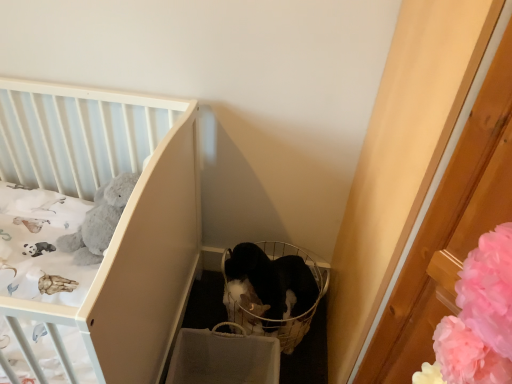
Question: Is black fabric basket at center surrounding white matte crib at upper left?

Choices:
 (A) no
 (B) yes

Answer: (A)

Question: Is black fabric basket at center oriented towards white matte crib at upper left?

Choices:
 (A) no
 (B) yes

Answer: (A)

Question: Considering the relative sizes of black fabric basket at center and white matte crib at upper left in the image provided, is black fabric basket at center bigger than white matte crib at upper left?

Choices:
 (A) no
 (B) yes

Answer: (A)

Question: From a real-world perspective, is black fabric basket at center physically above white matte crib at upper left?

Choices:
 (A) yes
 (B) no

Answer: (B)

Question: Considering the relative positions of black fabric basket at center and white matte crib at upper left in the image provided, is black fabric basket at center to the right of white matte crib at upper left from the viewer's perspective?

Choices:
 (A) yes
 (B) no

Answer: (A)

Question: Is black fur cat at center in front of or behind white matte crib at upper left in the image?

Choices:
 (A) behind
 (B) front

Answer: (A)

Question: Considering the positions of point (309, 281) and point (163, 142), is point (309, 281) closer or farther from the camera than point (163, 142)?

Choices:
 (A) closer
 (B) farther

Answer: (B)

Question: Considering the positions of black fur cat at center and white matte crib at upper left in the image, is black fur cat at center taller or shorter than white matte crib at upper left?

Choices:
 (A) tall
 (B) short

Answer: (B)

Question: Which is correct: black fur cat at center is inside white matte crib at upper left, or outside of it?

Choices:
 (A) outside
 (B) inside

Answer: (A)

Question: In terms of size, does white matte crib at upper left appear bigger or smaller than black fur cat at center?

Choices:
 (A) small
 (B) big

Answer: (B)

Question: From a real-world perspective, is white matte crib at upper left physically located above or below black fur cat at center?

Choices:
 (A) above
 (B) below

Answer: (A)

Question: From the image's perspective, is white matte crib at upper left above or below black fur cat at center?

Choices:
 (A) above
 (B) below

Answer: (A)

Question: Is white matte crib at upper left situated inside black fur cat at center or outside?

Choices:
 (A) inside
 (B) outside

Answer: (B)

Question: Is black fabric basket at center bigger or smaller than white matte crib at upper left?

Choices:
 (A) big
 (B) small

Answer: (B)

Question: In terms of height, does black fabric basket at center look taller or shorter compared to white matte crib at upper left?

Choices:
 (A) tall
 (B) short

Answer: (B)